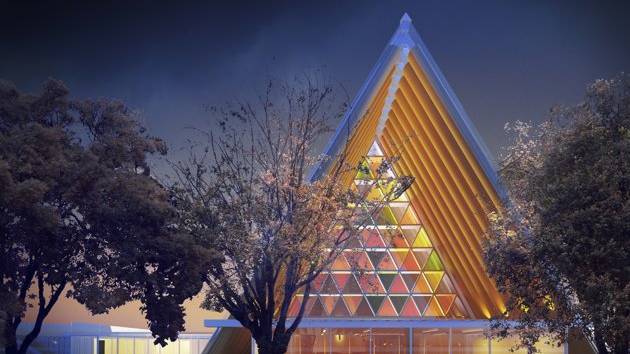
The width and height of the screenshot is (630, 354). Find the location of `upper point of triangle windows`. upper point of triangle windows is located at coordinates (372, 146).